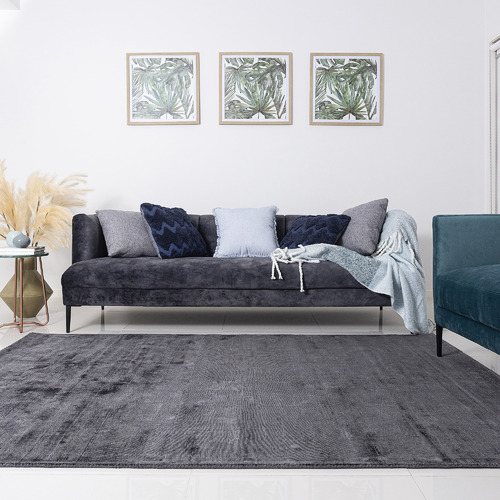
I want to click on tile floor, so click(x=397, y=488).